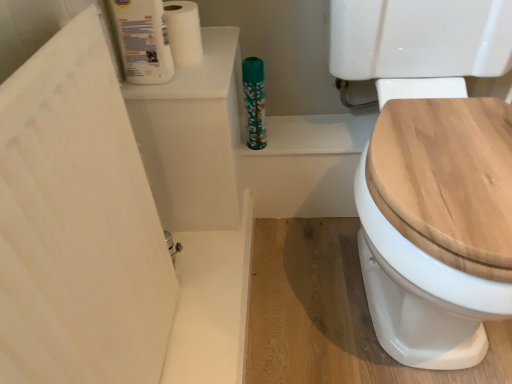
Find the location of a particular element. This screenshot has width=512, height=384. free spot in front of white matte toilet paper at upper left, the first toilet paper in the back-to-front sequence is located at coordinates (192, 78).